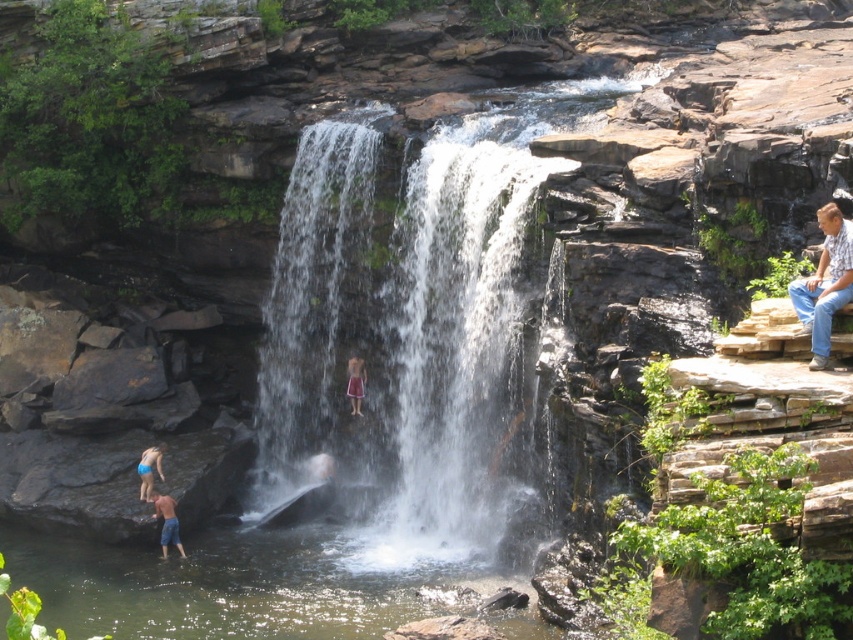
Question: Is blue denim shorts at lower left in front of blue fabric shorts at lower left?

Choices:
 (A) no
 (B) yes

Answer: (B)

Question: Is blue denim shorts at lower left further to the viewer compared to blue fabric shorts at lower left?

Choices:
 (A) no
 (B) yes

Answer: (A)

Question: Can you confirm if clear water at center is smaller than blue denim shorts at lower left?

Choices:
 (A) no
 (B) yes

Answer: (A)

Question: Which of the following is the closest to the observer?

Choices:
 (A) blue jeans at right
 (B) blue fabric shorts at lower left
 (C) reddish-brown fabric shorts at center
 (D) clear water at center

Answer: (A)

Question: Which of the following is the farthest from the observer?

Choices:
 (A) blue fabric shorts at lower left
 (B) blue jeans at right
 (C) clear water at center
 (D) reddish-brown fabric shorts at center

Answer: (D)

Question: Which of these objects is positioned farthest from the clear water at center?

Choices:
 (A) blue jeans at right
 (B) blue denim shorts at lower left

Answer: (A)